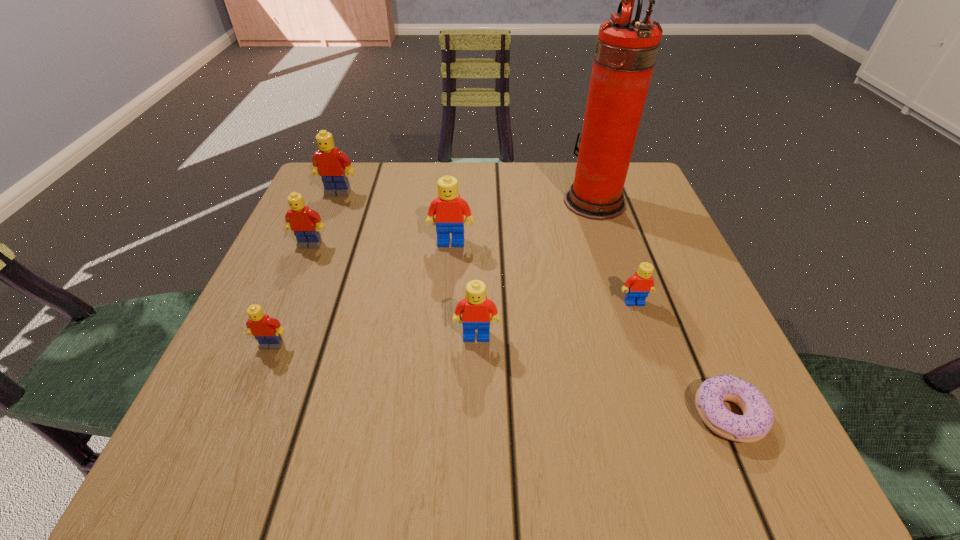
The width and height of the screenshot is (960, 540). Find the location of `vacant space positioned on the back of the purple doughnut`. vacant space positioned on the back of the purple doughnut is located at coordinates (671, 285).

Find the location of a particular element. The height and width of the screenshot is (540, 960). fire extinguisher that is at the far edge is located at coordinates tap(626, 50).

Find the location of a particular element. The height and width of the screenshot is (540, 960). Lego that is positioned at the far edge is located at coordinates (329, 163).

Locate an element on the screen. This screenshot has height=540, width=960. object located at the near edge is located at coordinates (757, 419).

Identify the location of fire extinguisher positioned at the right edge. (626, 50).

Identify the location of Lego that is positioned at the right edge. (638, 286).

Locate an element on the screen. Image resolution: width=960 pixels, height=540 pixels. doughnut that is at the right edge is located at coordinates (757, 419).

Where is `object present at the far left corner`? The image size is (960, 540). object present at the far left corner is located at coordinates (329, 163).

At what (x,y) coordinates should I click in order to perform the action: click on object that is positioned at the far right corner. Please return your answer as a coordinate pair (x, y). The height and width of the screenshot is (540, 960). Looking at the image, I should click on (626, 50).

Find the location of a particular element. object present at the near right corner is located at coordinates (757, 419).